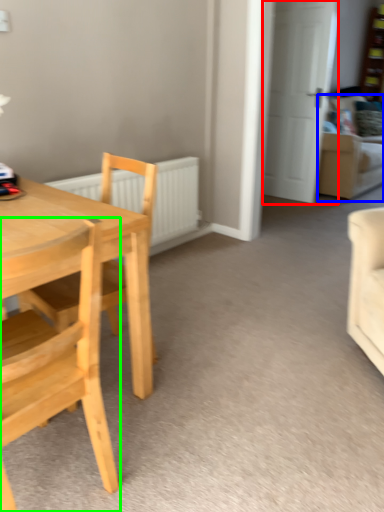
Question: Based on their relative distances, which object is farther from door (highlighted by a red box)? Choose from couch (highlighted by a blue box) and chair (highlighted by a green box).

Choices:
 (A) couch
 (B) chair

Answer: (B)